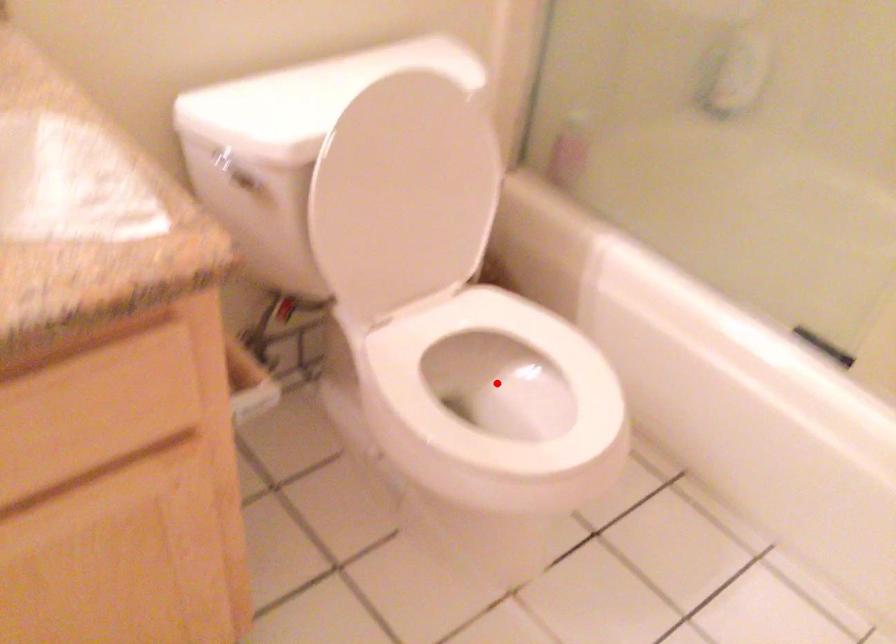
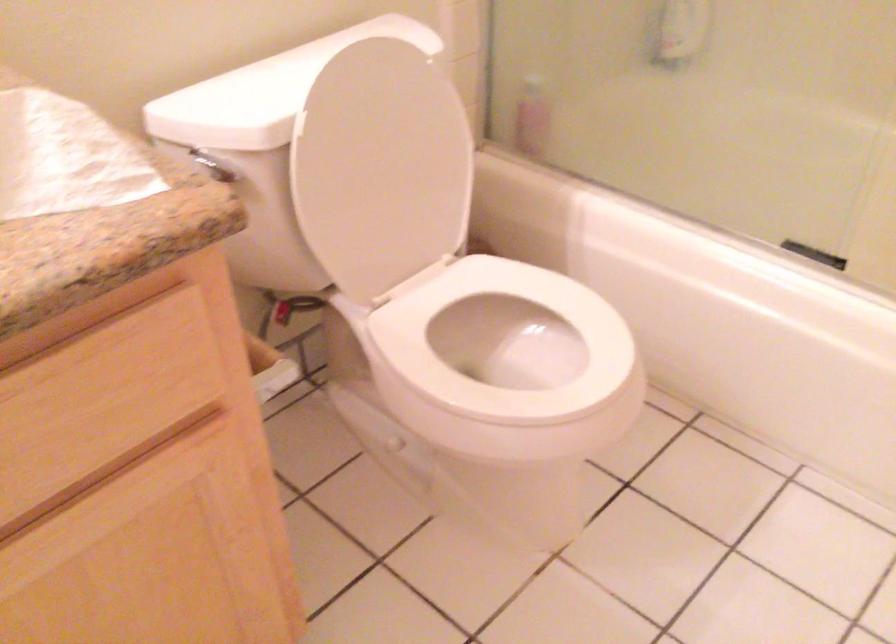
In the second image, find the point that corresponds to the highlighted location in the first image.

(504, 348)